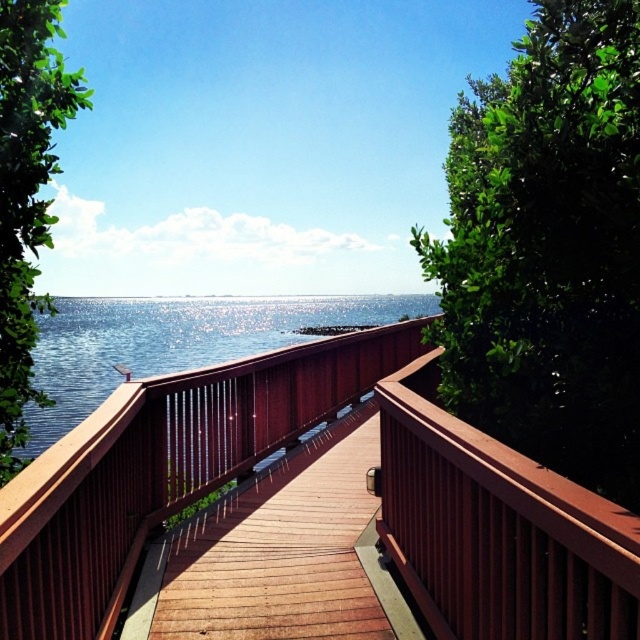
Does point (291, 316) come in front of point (33, 125)?

No, (291, 316) is further to viewer.

Does point (180, 298) lie in front of point (12, 170)?

That is False.

The image size is (640, 640). What are the coordinates of `shiny blue water at center` in the screenshot? It's located at (172, 342).

Is wooden deck at center bigger than shiny blue water at center?

Actually, wooden deck at center might be smaller than shiny blue water at center.

Between point (588, 605) and point (378, 323), which one is positioned in front?

Point (588, 605) is in front.

Between point (308, 396) and point (291, 320), which one is positioned in front?

Point (308, 396) is in front.

Find the location of `wooden deck at center`. wooden deck at center is located at coordinates (289, 449).

Can you confirm if green leafy tree at right is shorter than green leafy tree at left?

Indeed, green leafy tree at right has a lesser height compared to green leafy tree at left.

Can you confirm if green leafy tree at right is bigger than green leafy tree at left?

No, green leafy tree at right is not bigger than green leafy tree at left.

Find the location of a particular element. The height and width of the screenshot is (640, 640). green leafy tree at right is located at coordinates (548, 248).